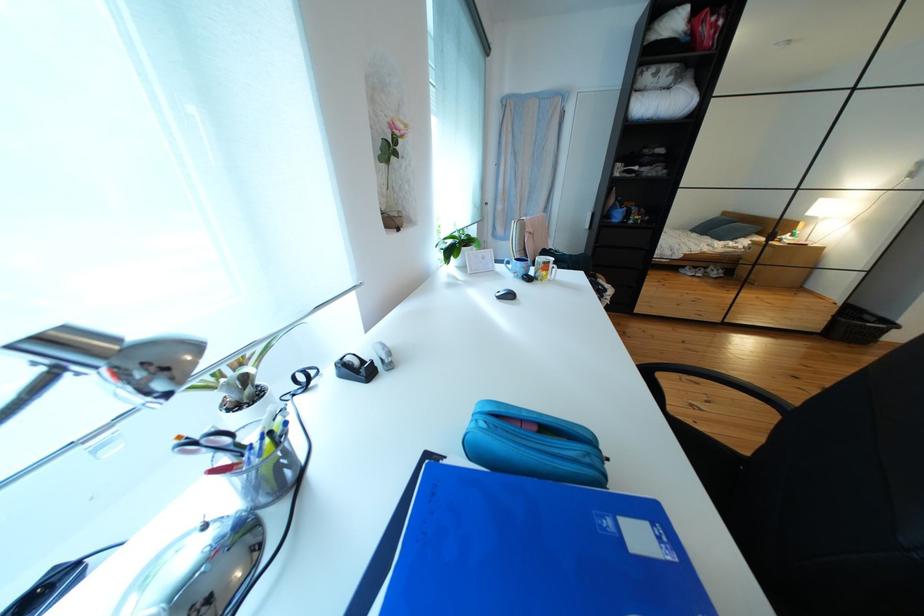
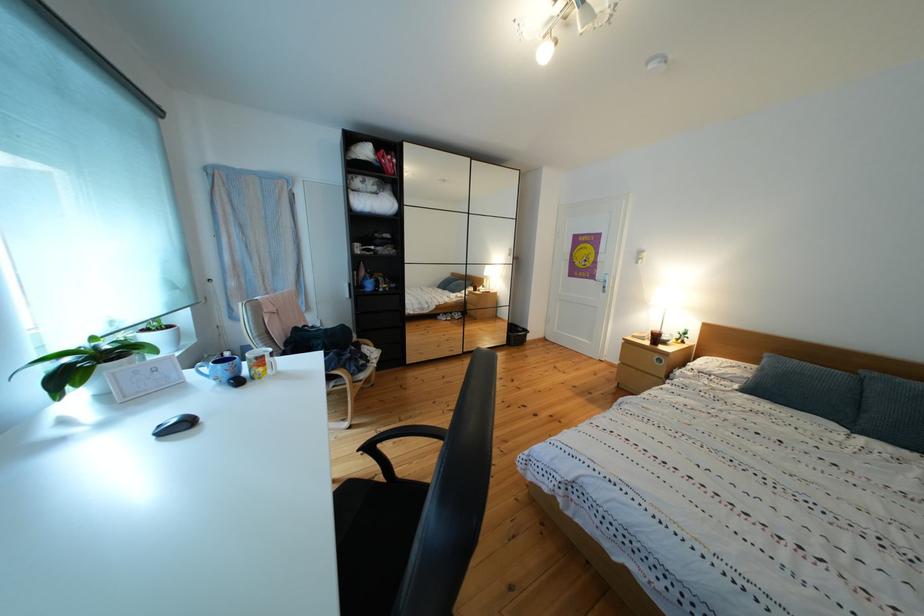
Where in the second image is the point corresponding to pixel 657 377 from the first image?

(382, 454)